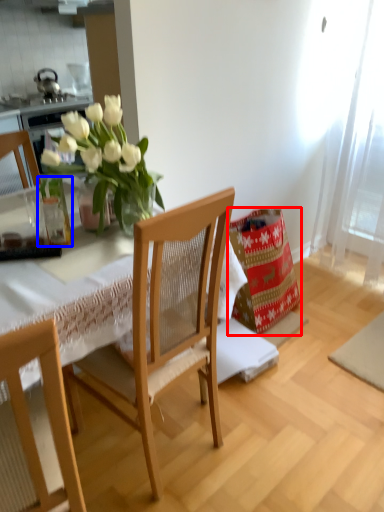
Question: Which of the following is the closest to the observer, material (highlighted by a red box) or glass vase (highlighted by a blue box)?

Choices:
 (A) material
 (B) glass vase

Answer: (B)